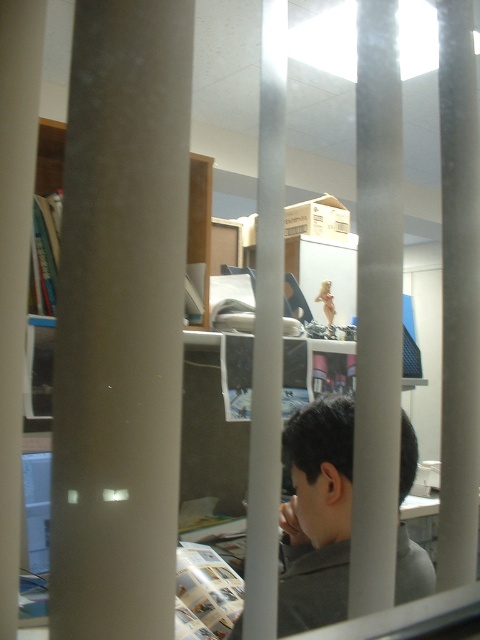
Based on the scene description, what object is located at the coordinates point (120,321)?

The point (120,321) indicates the location of the matte gray pillar at center.

You are standing outside the room and looking through the window. There is a matte gray pillar at center and a gray matte shirt at center. Which object is closer to the left side of the window?

The matte gray pillar at center is positioned on the left side of gray matte shirt at center, so it is closer to the left side of the window.